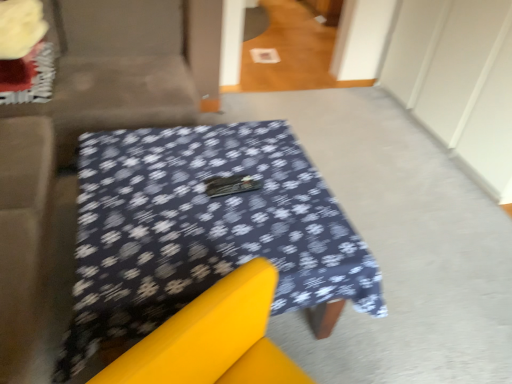
Question: Considering the relative sizes of dark blue fabric-covered table at center and fluffy yellow flower at upper left in the image provided, is dark blue fabric-covered table at center smaller than fluffy yellow flower at upper left?

Choices:
 (A) yes
 (B) no

Answer: (B)

Question: Is dark blue fabric-covered table at center closer to the viewer compared to fluffy yellow flower at upper left?

Choices:
 (A) no
 (B) yes

Answer: (B)

Question: Considering the relative positions of dark blue fabric-covered table at center and fluffy yellow flower at upper left in the image provided, is dark blue fabric-covered table at center to the left of fluffy yellow flower at upper left from the viewer's perspective?

Choices:
 (A) yes
 (B) no

Answer: (B)

Question: Would you say dark blue fabric-covered table at center is outside fluffy yellow flower at upper left?

Choices:
 (A) no
 (B) yes

Answer: (B)

Question: Can you confirm if dark blue fabric-covered table at center is positioned to the right of fluffy yellow flower at upper left?

Choices:
 (A) no
 (B) yes

Answer: (B)

Question: From a real-world perspective, is velvet beige couch at upper left physically located above or below dark blue fabric-covered table at center?

Choices:
 (A) below
 (B) above

Answer: (B)

Question: Is velvet beige couch at upper left inside the boundaries of dark blue fabric-covered table at center, or outside?

Choices:
 (A) inside
 (B) outside

Answer: (B)

Question: Is point (144, 33) closer or farther from the camera than point (172, 213)?

Choices:
 (A) farther
 (B) closer

Answer: (A)

Question: From the image's perspective, is velvet beige couch at upper left above or below dark blue fabric-covered table at center?

Choices:
 (A) below
 (B) above

Answer: (B)

Question: Is point (134, 69) closer or farther from the camera than point (14, 46)?

Choices:
 (A) closer
 (B) farther

Answer: (B)

Question: From the image's perspective, is velvet beige couch at upper left positioned above or below fluffy yellow flower at upper left?

Choices:
 (A) above
 (B) below

Answer: (B)

Question: Is velvet beige couch at upper left to the left or to the right of fluffy yellow flower at upper left in the image?

Choices:
 (A) left
 (B) right

Answer: (B)

Question: Considering their positions, is velvet beige couch at upper left located in front of or behind fluffy yellow flower at upper left?

Choices:
 (A) front
 (B) behind

Answer: (A)

Question: Relative to fluffy yellow flower at upper left, is dark blue fabric-covered table at center in front or behind?

Choices:
 (A) front
 (B) behind

Answer: (A)

Question: In terms of width, does dark blue fabric-covered table at center look wider or thinner when compared to fluffy yellow flower at upper left?

Choices:
 (A) thin
 (B) wide

Answer: (B)